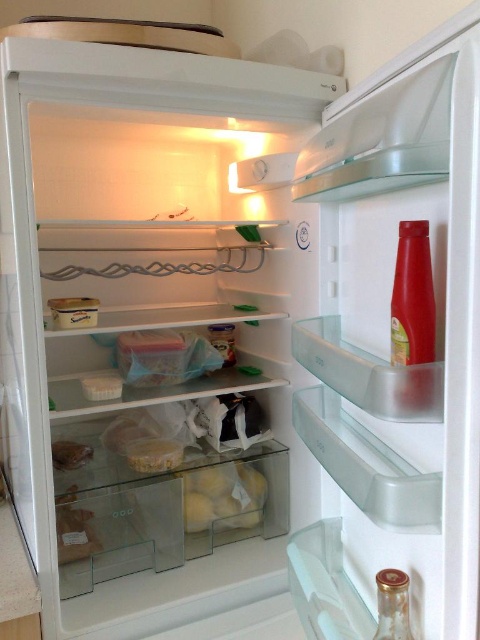
Question: Can you confirm if translucent plastic bag at lower left is positioned to the left of translucent plastic container at center?

Choices:
 (A) no
 (B) yes

Answer: (B)

Question: Which of the following is the farthest from the observer?

Choices:
 (A) translucent plastic container at center
 (B) translucent plastic bag of potatoes at lower center
 (C) translucent plastic bag at lower center
 (D) translucent plastic bag at lower left

Answer: (B)

Question: Which point is closer to the camera?

Choices:
 (A) translucent plastic bag at lower left
 (B) translucent plastic bag of potatoes at lower center

Answer: (A)

Question: Is translucent plastic bag of potatoes at lower center positioned in front of translucent plastic bag at lower left?

Choices:
 (A) yes
 (B) no

Answer: (B)

Question: Can you confirm if translucent plastic bag at lower left is positioned to the right of translucent plastic container at center?

Choices:
 (A) no
 (B) yes

Answer: (A)

Question: Which point is farther from the camera taking this photo?

Choices:
 (A) (180, 461)
 (B) (60, 449)
 (C) (247, 500)
 (D) (79, 557)

Answer: (C)